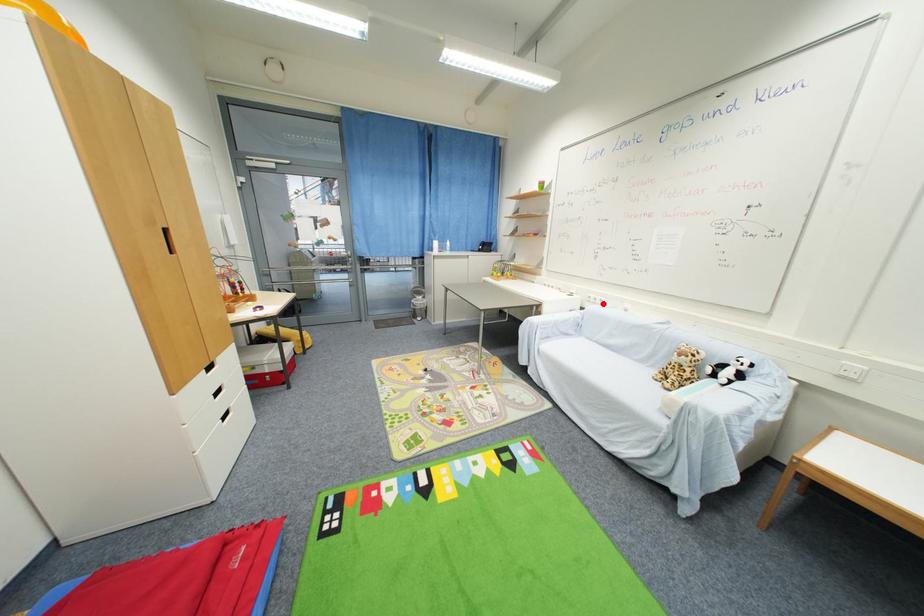
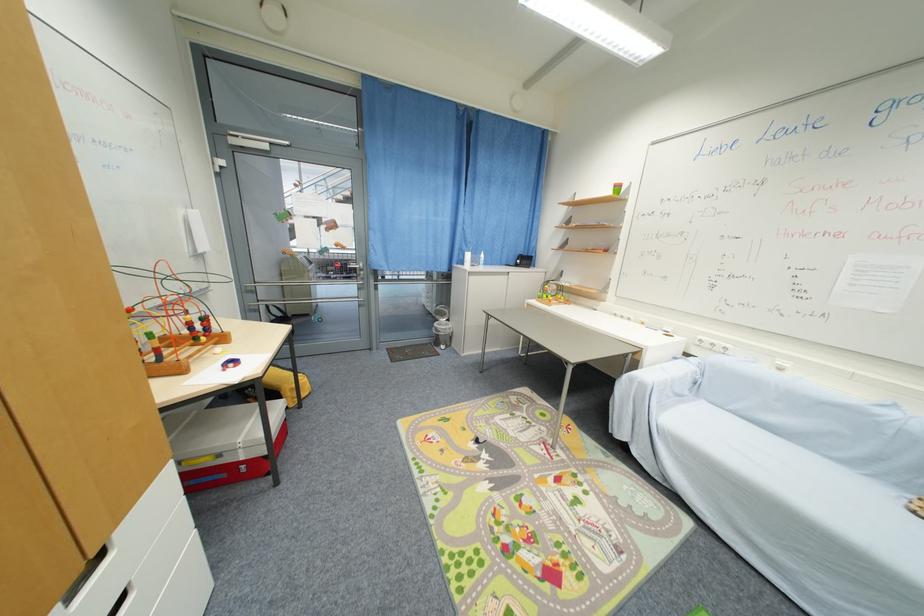
In the second image, find the point that corresponds to the highlighted location in the first image.

(723, 351)